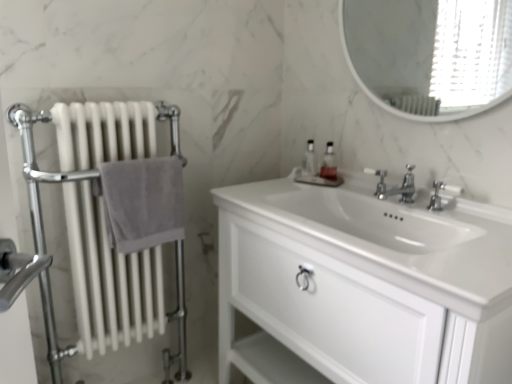
Question: Considering the positions of polished chrome faucet at center and white metal radiator at left in the image, is polished chrome faucet at center wider or thinner than white metal radiator at left?

Choices:
 (A) thin
 (B) wide

Answer: (A)

Question: Would you say polished chrome faucet at center is to the left or to the right of white metal radiator at left in the picture?

Choices:
 (A) right
 (B) left

Answer: (A)

Question: Which is farther from the white glossy cabinet at center?

Choices:
 (A) translucent plastic soap dispenser at center, the 2th soap dispenser when ordered from left to right
 (B) gray cotton towel at left
 (C) polished chrome faucet at center, the 1th tap viewed from the right
 (D) white metal radiator at left
 (E) translucent glass soap dispenser at center, which appears as the 2th soap dispenser when viewed from the right

Answer: (D)

Question: Considering the real-world distances, which object is farthest from the translucent glass soap dispenser at center, which appears as the 2th soap dispenser when viewed from the right?

Choices:
 (A) gray cotton towel at left
 (B) white metal radiator at left
 (C) polished chrome faucet at center
 (D) translucent plastic soap dispenser at center, the first soap dispenser in the right-to-left sequence
 (E) white glossy mirror at upper center

Answer: (E)